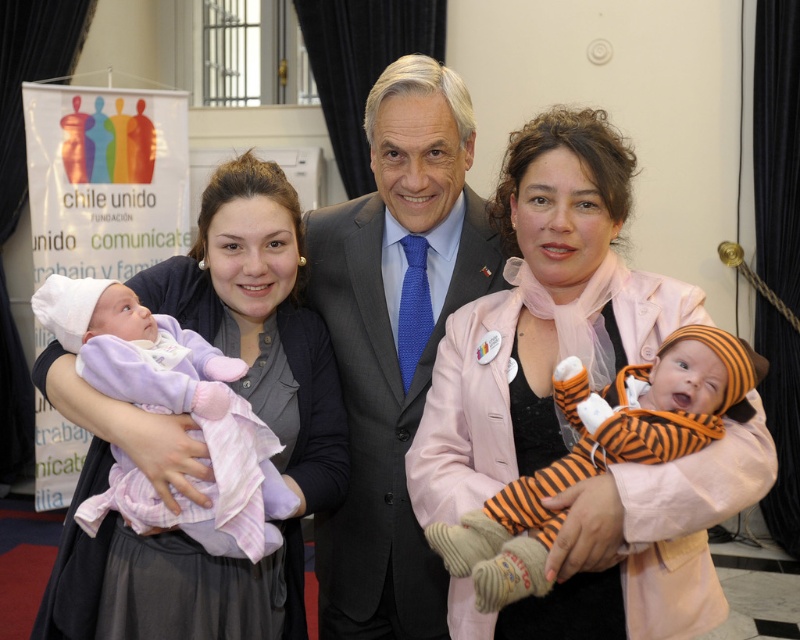
You are a photographer at the event and want to focus your camera on the orange striped onesie at center. The camera requires you to first center the focus on the point at coordinates [600,452]. Is this the correct point to focus on to capture the orange striped onesie at center?

Yes, the point at coordinates [600,452] corresponds to the orange striped onesie at center, so focusing there will correctly capture it.

You are a photographer at the event and want to ensure that the matte gray blazer at center is visible in the photo. Where should you position the camera relative to the point marked at coordinates point [197,440] to ensure it is in the frame?

The matte gray blazer at center is represented by point [197,440], so positioning the camera directly facing this point will ensure the blazer is centered and visible in the photo.

You are standing in front of the group photo and want to place a small gift at the location marked by point (189,628) and another gift at point (490,602). Which point is closer to you?

Point (189,628) is closer to you because it is further to the viewer than point (490,602).